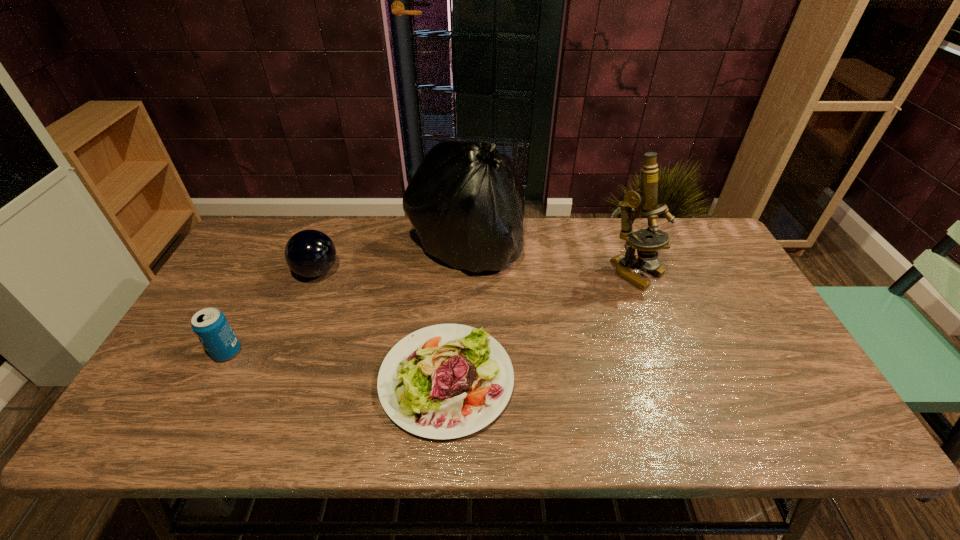
Identify the location of plastic bag that is at the far edge. The width and height of the screenshot is (960, 540). (466, 202).

You are a GUI agent. You are given a task and a screenshot of the screen. Output one action in this format:
    pyautogui.click(x=<x>, y=<y>)
    Task: Click on the microscope positioned at the far edge
    The image size is (960, 540).
    Given the screenshot: What is the action you would take?
    pyautogui.click(x=645, y=198)

Image resolution: width=960 pixels, height=540 pixels. In order to click on bowling ball present at the far edge in this screenshot , I will do `click(309, 253)`.

Identify the location of object located in the near edge section of the desktop. (x=445, y=381).

I want to click on object located at the left edge, so click(210, 325).

Find the location of a particular element. The width and height of the screenshot is (960, 540). free point at the far edge is located at coordinates (356, 227).

Locate an element on the screen. The image size is (960, 540). vacant space at the near edge is located at coordinates (356, 413).

You are a GUI agent. You are given a task and a screenshot of the screen. Output one action in this format:
    pyautogui.click(x=<x>, y=<y>)
    Task: Click on the vacant space at the left edge of the desktop
    
    Given the screenshot: What is the action you would take?
    pyautogui.click(x=246, y=267)

You are a GUI agent. You are given a task and a screenshot of the screen. Output one action in this format:
    pyautogui.click(x=<x>, y=<y>)
    Task: Click on the vacant space at the right edge of the desktop
    This screenshot has width=960, height=540.
    Given the screenshot: What is the action you would take?
    pyautogui.click(x=810, y=389)

I want to click on vacant area at the far left corner, so click(270, 260).